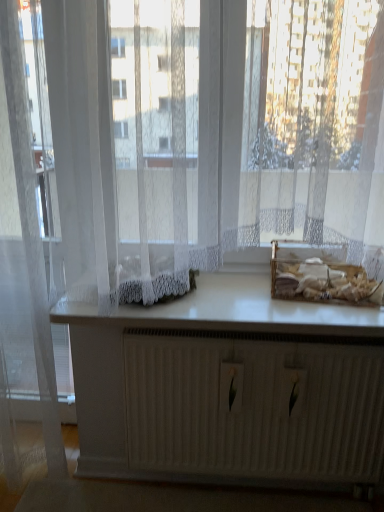
The height and width of the screenshot is (512, 384). What are the coordinates of `translucent plastic basket at center` in the screenshot? It's located at (321, 280).

Locate an element on the screen. This screenshot has width=384, height=512. white matte radiator at center is located at coordinates (228, 388).

Measure the distance between translucent white curtain at left and camera.

translucent white curtain at left and camera are 1.22 meters apart from each other.

I want to click on white lace curtains at center, so click(x=311, y=126).

What's the angular difference between white smooth countertop at center and white matte radiator at center's facing directions?

The angular difference between white smooth countertop at center and white matte radiator at center is 1.33 degrees.

How distant is white smooth countertop at center from white matte radiator at center?

8.27 inches.

From a real-world perspective, is white smooth countertop at center over white matte radiator at center?

Yes.

Considering the sizes of white smooth countertop at center and white matte radiator at center in the image, is white smooth countertop at center taller or shorter than white matte radiator at center?

In the image, white smooth countertop at center appears to be shorter than white matte radiator at center.

Is white lace curtains at center placed right next to white matte radiator at center?

No, white lace curtains at center is not next to white matte radiator at center.

Which is further, (x=379, y=208) or (x=245, y=355)?

The point (x=245, y=355) is more distant.

Which object is closer to the camera taking this photo, white lace curtains at center or white matte radiator at center?

white lace curtains at center is more forward.

Consider the image. Considering the sizes of translucent plastic basket at center and white matte radiator at center in the image, is translucent plastic basket at center taller or shorter than white matte radiator at center?

Considering their sizes, translucent plastic basket at center has less height than white matte radiator at center.

Would you say translucent plastic basket at center contains white matte radiator at center?

No, white matte radiator at center is not inside translucent plastic basket at center.

Can we say white matte radiator at center lies outside translucent plastic basket at center?

Yes, white matte radiator at center is not within translucent plastic basket at center.

Which is behind, point (190, 407) or point (293, 293)?

The point (190, 407) is farther.

What are the coordinates of `vanity that appears below the translucent plastic basket at center (from the image's perspective)` in the screenshot? It's located at (228, 388).

What's the angular difference between white matte radiator at center and translucent plastic basket at center's facing directions?

6 degrees separate the facing orientations of white matte radiator at center and translucent plastic basket at center.

Considering the relative positions of white smooth countertop at center and translucent plastic basket at center in the image provided, is white smooth countertop at center to the left of translucent plastic basket at center from the viewer's perspective?

Indeed, white smooth countertop at center is positioned on the left side of translucent plastic basket at center.

Is white smooth countertop at center placed right next to translucent plastic basket at center?

white smooth countertop at center and translucent plastic basket at center are clearly separated.

Does white smooth countertop at center have a greater height compared to translucent plastic basket at center?

No, white smooth countertop at center is not taller than translucent plastic basket at center.

Is white smooth countertop at center turned away from translucent plastic basket at center?

No, translucent plastic basket at center is not at the back of white smooth countertop at center.

Would you say translucent white curtain at left is inside or outside white matte radiator at center?

translucent white curtain at left exists outside the volume of white matte radiator at center.

Locate an element on the screen. Image resolution: width=384 pixels, height=512 pixels. curtain located above the white matte radiator at center (from the image's perspective) is located at coordinates (31, 234).

Considering the relative positions of translucent white curtain at left and white matte radiator at center in the image provided, is translucent white curtain at left to the left or to the right of white matte radiator at center?

Clearly, translucent white curtain at left is on the left of white matte radiator at center in the image.

In the image, there is a translucent white curtain at left. In order to click on vanity below it (from a real-world perspective) in this screenshot , I will do `click(228, 388)`.

Can you confirm if white matte radiator at center is thinner than translucent white curtain at left?

Yes.

Which is more to the right, white matte radiator at center or translucent white curtain at left?

From the viewer's perspective, white matte radiator at center appears more on the right side.

Locate an element on the screen. vanity that is behind the white smooth countertop at center is located at coordinates (228, 388).

At what (x,y) coordinates should I click in order to perform the action: click on bay window to the left of white matte radiator at center. Please return your answer as a coordinate pair (x, y). Image resolution: width=384 pixels, height=512 pixels. Looking at the image, I should click on point(311,126).

Which object lies further to the anchor point white smooth countertop at center, translucent white curtain at left or white lace curtains at center?

translucent white curtain at left lies further to white smooth countertop at center than the other object.

Looking at the image, which one is located further to white lace curtains at center, translucent white curtain at left or translucent plastic basket at center?

translucent white curtain at left is positioned further to the anchor white lace curtains at center.

From the picture: From the image, which object appears to be farther from white lace curtains at center, white matte radiator at center or translucent plastic basket at center?

white matte radiator at center is further to white lace curtains at center.

When comparing their distances from white smooth countertop at center, does translucent plastic basket at center or white matte radiator at center seem closer?

translucent plastic basket at center is positioned closer to the anchor white smooth countertop at center.

When comparing their distances from white lace curtains at center, does white matte radiator at center or translucent white curtain at left seem closer?

The object closer to white lace curtains at center is white matte radiator at center.

Looking at the image, which one is located further to white matte radiator at center, translucent white curtain at left or white smooth countertop at center?

The object further to white matte radiator at center is translucent white curtain at left.

Estimate the real-world distances between objects in this image. Which object is further from white smooth countertop at center, translucent plastic basket at center or white lace curtains at center?

Based on the image, white lace curtains at center appears to be further to white smooth countertop at center.

Looking at this image, which object lies further to the anchor point translucent white curtain at left, white smooth countertop at center or translucent plastic basket at center?

Based on the image, translucent plastic basket at center appears to be further to translucent white curtain at left.

You are a GUI agent. You are given a task and a screenshot of the screen. Output one action in this format:
    pyautogui.click(x=<x>, y=<y>)
    Task: Click on the counter top situated between translucent white curtain at left and translucent plastic basket at center from left to right
    The width and height of the screenshot is (384, 512).
    Given the screenshot: What is the action you would take?
    pyautogui.click(x=233, y=312)

What are the coordinates of `bay window located between translucent white curtain at left and white matte radiator at center in the left-right direction` in the screenshot? It's located at (311, 126).

I want to click on bay window situated between translucent white curtain at left and translucent plastic basket at center from left to right, so click(311, 126).

This screenshot has height=512, width=384. Find the location of `cardboard box between white lace curtains at center and white smooth countertop at center from top to bottom`. cardboard box between white lace curtains at center and white smooth countertop at center from top to bottom is located at coordinates (321, 280).